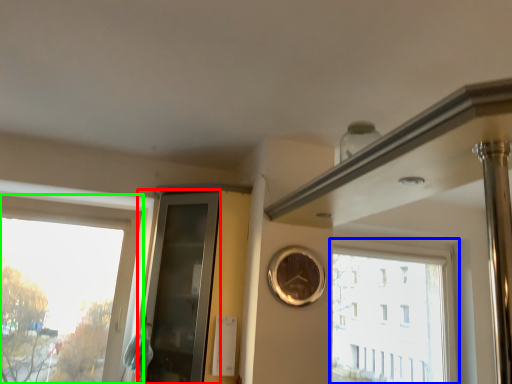
Question: Based on their relative distances, which object is farther from glass door (highlighted by a red box)? Choose from window (highlighted by a blue box) and window (highlighted by a green box).

Choices:
 (A) window
 (B) window

Answer: (A)